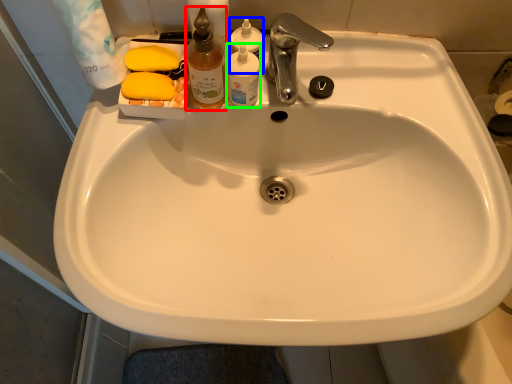
Question: Based on their relative distances, which object is farther from cleaning product (highlighted by a red box)? Choose from cleaning product (highlighted by a blue box) and toiletry (highlighted by a green box).

Choices:
 (A) cleaning product
 (B) toiletry

Answer: (A)